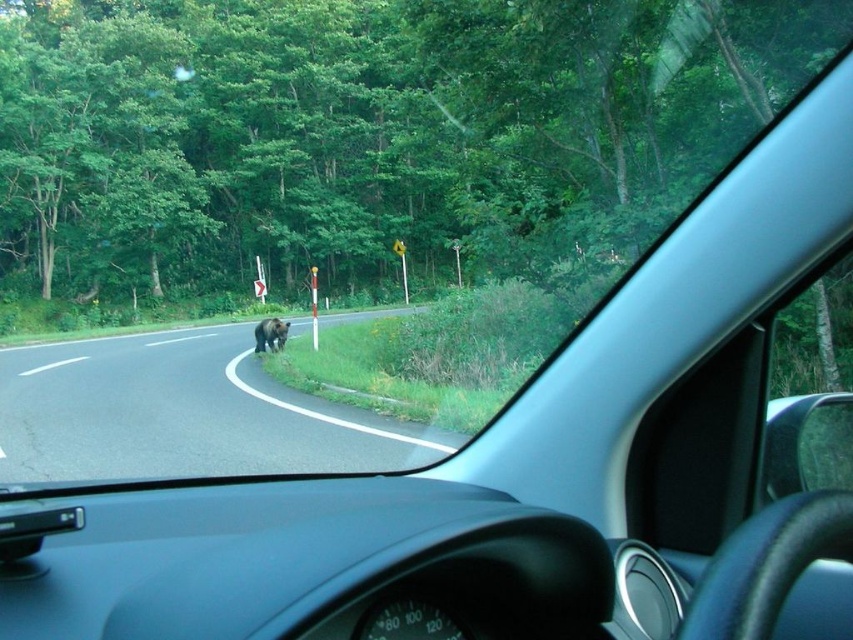
Based on the photo, is dark asphalt road at center closer to camera compared to brown furry bear at center?

Yes.

Between point (38, 435) and point (258, 332), which one is positioned in front?

Point (38, 435)

Where is `dark asphalt road at center`? This screenshot has height=640, width=853. dark asphalt road at center is located at coordinates (181, 413).